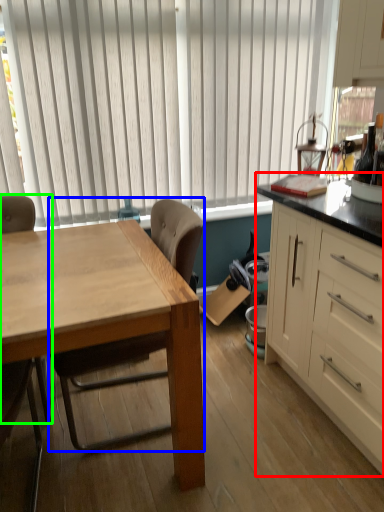
Question: Which object is positioned closest to cabinetry (highlighted by a red box)? Select from chair (highlighted by a blue box) and chair (highlighted by a green box).

Choices:
 (A) chair
 (B) chair

Answer: (A)